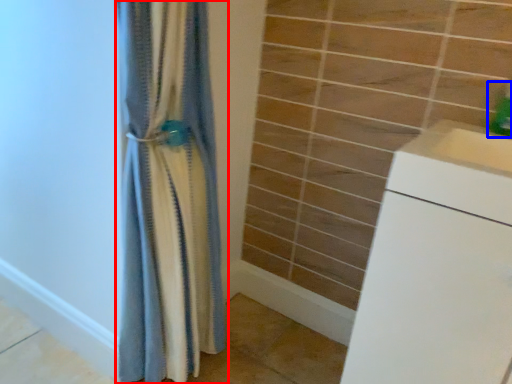
Question: Which point is further to the camera, curtain (highlighted by a red box) or soap dispenser (highlighted by a blue box)?

Choices:
 (A) curtain
 (B) soap dispenser

Answer: (B)